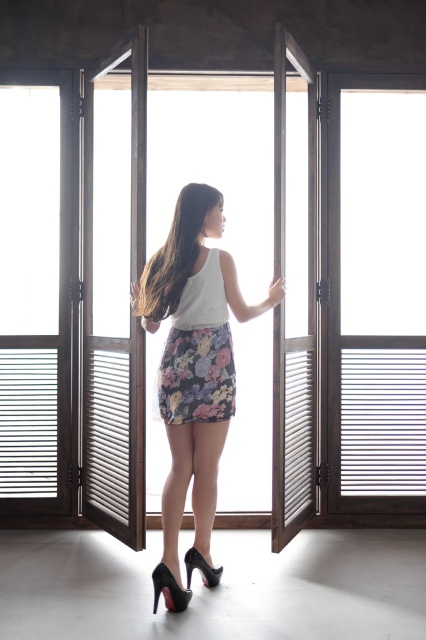
Question: Which object is positioned farthest from the floral fabric skirt at center?

Choices:
 (A) black patent leather high-heeled shoe at lower center
 (B) floral-patterned fabric skirt at center

Answer: (A)

Question: Does wooden slatted door at right have a lesser width compared to floral fabric skirt at center?

Choices:
 (A) yes
 (B) no

Answer: (B)

Question: Which point appears farthest from the camera in this image?

Choices:
 (A) (201, 561)
 (B) (184, 593)
 (C) (187, 486)

Answer: (A)

Question: Which point is closer to the camera?

Choices:
 (A) black patent leather high-heeled shoe at lower center
 (B) wooden slatted door at right

Answer: (A)

Question: Can you confirm if floral fabric skirt at center is positioned above floral-patterned fabric skirt at center?

Choices:
 (A) yes
 (B) no

Answer: (B)

Question: Does floral-patterned fabric skirt at center have a greater width compared to black patent leather high-heeled shoe at lower center?

Choices:
 (A) yes
 (B) no

Answer: (A)